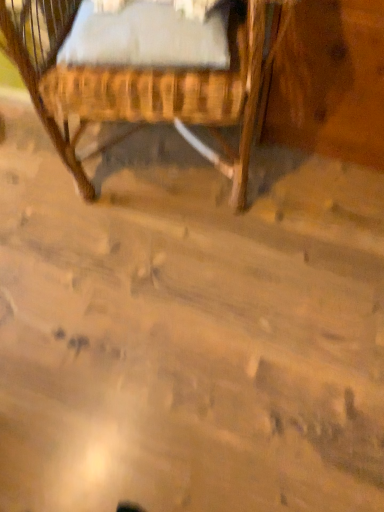
Where is `woven wood crib at upper left`? The height and width of the screenshot is (512, 384). woven wood crib at upper left is located at coordinates (148, 71).

Image resolution: width=384 pixels, height=512 pixels. What do you see at coordinates (148, 71) in the screenshot?
I see `woven wood crib at upper left` at bounding box center [148, 71].

Measure the distance between point (192, 6) and camera.

Point (192, 6) and camera are 87.30 centimeters apart.

At what (x,y) coordinates should I click in order to perform the action: click on white soft fabric at upper center. Please return your answer as a coordinate pair (x, y). The height and width of the screenshot is (512, 384). Looking at the image, I should click on click(146, 35).

What do you see at coordinates (146, 35) in the screenshot?
I see `white soft fabric at upper center` at bounding box center [146, 35].

Where is `woven wood crib at upper left`? Image resolution: width=384 pixels, height=512 pixels. woven wood crib at upper left is located at coordinates (148, 71).

Does woven wood crib at upper left appear on the right side of white soft fabric at upper center?

No.

Consider the image. Who is more distant, woven wood crib at upper left or white soft fabric at upper center?

white soft fabric at upper center.

Which point is more forward, (141, 112) or (216, 53)?

The point (216, 53) is closer.

From the image's perspective, relative to white soft fabric at upper center, is woven wood crib at upper left above or below?

Based on their image positions, woven wood crib at upper left is located above white soft fabric at upper center.

From a real-world perspective, is woven wood crib at upper left located beneath white soft fabric at upper center?

Correct, in the physical world, woven wood crib at upper left is lower than white soft fabric at upper center.

Based on the photo, in terms of width, does woven wood crib at upper left look wider or thinner when compared to white soft fabric at upper center?

Considering their sizes, woven wood crib at upper left looks broader than white soft fabric at upper center.

Is woven wood crib at upper left taller than white soft fabric at upper center?

Indeed, woven wood crib at upper left has a greater height compared to white soft fabric at upper center.

In terms of size, does woven wood crib at upper left appear bigger or smaller than white soft fabric at upper center?

Clearly, woven wood crib at upper left is larger in size than white soft fabric at upper center.

Is woven wood crib at upper left situated inside white soft fabric at upper center or outside?

woven wood crib at upper left is spatially situated outside white soft fabric at upper center.

Does woven wood crib at upper left touch white soft fabric at upper center?

Yes, woven wood crib at upper left is in contact with white soft fabric at upper center.

Is woven wood crib at upper left oriented away from white soft fabric at upper center?

No, woven wood crib at upper left's orientation is not away from white soft fabric at upper center.

What's the angular difference between woven wood crib at upper left and white soft fabric at upper center's facing directions?

They differ by 4.41 degrees in their facing directions.

This screenshot has width=384, height=512. I want to click on sheet located on the right of woven wood crib at upper left, so pyautogui.click(x=146, y=35).

Which is more to the right, white soft fabric at upper center or woven wood crib at upper left?

white soft fabric at upper center.

Is the depth of white soft fabric at upper center less than that of woven wood crib at upper left?

No, it is behind woven wood crib at upper left.

Looking at this image, which point is more forward, (92,10) or (205,42)?

The point (205,42) is closer to the camera.

From the image's perspective, between white soft fabric at upper center and woven wood crib at upper left, which one is located above?

woven wood crib at upper left.

From a real-world perspective, between white soft fabric at upper center and woven wood crib at upper left, who is vertically higher?

From a 3D spatial view, white soft fabric at upper center is above.

Does white soft fabric at upper center have a greater width compared to woven wood crib at upper left?

In fact, white soft fabric at upper center might be narrower than woven wood crib at upper left.

Consider the image. Considering the sizes of white soft fabric at upper center and woven wood crib at upper left in the image, is white soft fabric at upper center taller or shorter than woven wood crib at upper left?

white soft fabric at upper center is shorter than woven wood crib at upper left.

Considering the relative sizes of white soft fabric at upper center and woven wood crib at upper left in the image provided, is white soft fabric at upper center bigger than woven wood crib at upper left?

Incorrect, white soft fabric at upper center is not larger than woven wood crib at upper left.

Which is correct: white soft fabric at upper center is inside woven wood crib at upper left, or outside of it?

white soft fabric at upper center is inside woven wood crib at upper left.

Would you consider white soft fabric at upper center to be distant from woven wood crib at upper left?

No, white soft fabric at upper center is not far from woven wood crib at upper left.

Is white soft fabric at upper center oriented away from woven wood crib at upper left?

Yes, white soft fabric at upper center is facing away from woven wood crib at upper left.

How many degrees apart are the facing directions of white soft fabric at upper center and woven wood crib at upper left?

The facing directions of white soft fabric at upper center and woven wood crib at upper left are 4.41 degrees apart.

Locate an element on the screen. The width and height of the screenshot is (384, 512). sheet to the right of woven wood crib at upper left is located at coordinates (146, 35).

In order to click on sheet located on the right of woven wood crib at upper left in this screenshot , I will do `click(146, 35)`.

Image resolution: width=384 pixels, height=512 pixels. I want to click on sheet that appears above the woven wood crib at upper left (from a real-world perspective), so click(146, 35).